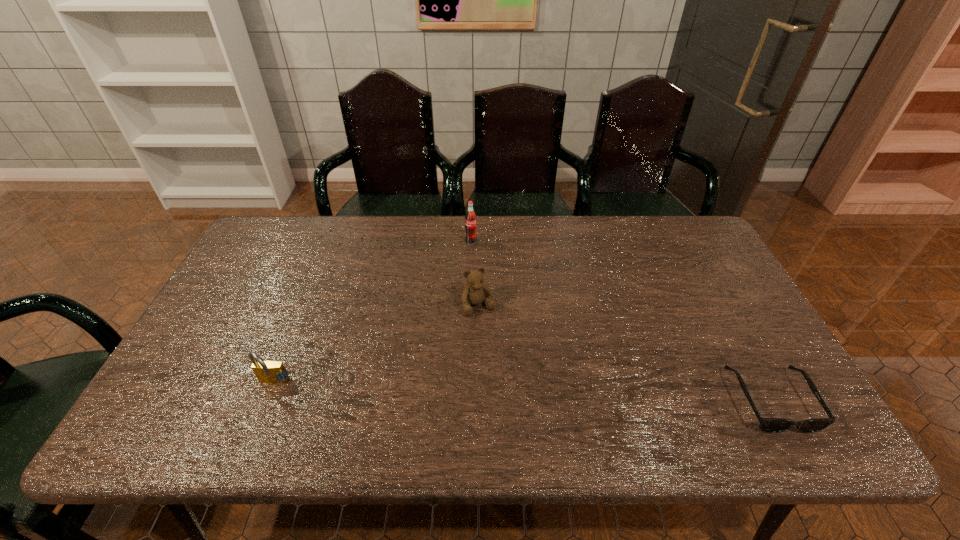
Where is `free space on the desktop that is between the leftmost object and the rightmost object and is positioned on the label of the soda bottle`? Image resolution: width=960 pixels, height=540 pixels. free space on the desktop that is between the leftmost object and the rightmost object and is positioned on the label of the soda bottle is located at coordinates (548, 393).

You are a GUI agent. You are given a task and a screenshot of the screen. Output one action in this format:
    pyautogui.click(x=<x>, y=<y>)
    Task: Click on the vacant space on the desktop that is between the leftmost object and the shortest object and is positioned on the front-facing side of the third nearest object
    
    Given the screenshot: What is the action you would take?
    pyautogui.click(x=519, y=392)